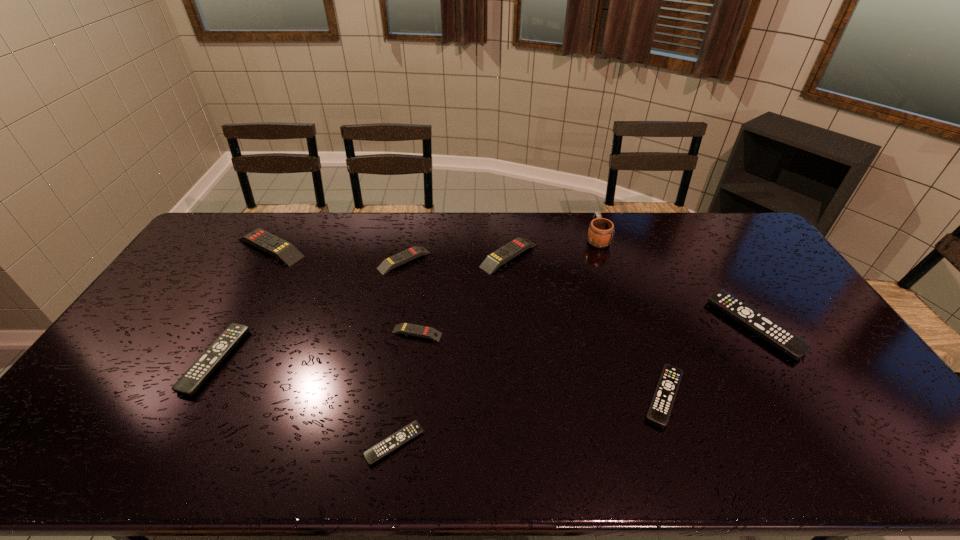
Find the location of `mug`. mug is located at coordinates (601, 231).

Where is `the tallest remote control`? The height and width of the screenshot is (540, 960). the tallest remote control is located at coordinates (286, 252).

At what (x,y) coordinates should I click in order to perform the action: click on the biggest yellow remote control. Please return your answer as a coordinate pair (x, y). Looking at the image, I should click on (286, 252).

Locate an element on the screen. The image size is (960, 540). the third remote control from right to left is located at coordinates (493, 261).

Find the location of a particular element. The image size is (960, 540). the fourth object from right to left is located at coordinates (493, 261).

Where is `the rightmost black remote control`? the rightmost black remote control is located at coordinates (778, 336).

Find the location of a particular element. Image resolution: width=960 pixels, height=540 pixels. the biggest black remote control is located at coordinates (778, 336).

Identify the location of the third biggest yellow remote control. (394, 261).

Locate an element on the screen. The image size is (960, 540). the third smallest black remote control is located at coordinates (204, 366).

Where is `the nearest yellow remote control`? The image size is (960, 540). the nearest yellow remote control is located at coordinates (404, 328).